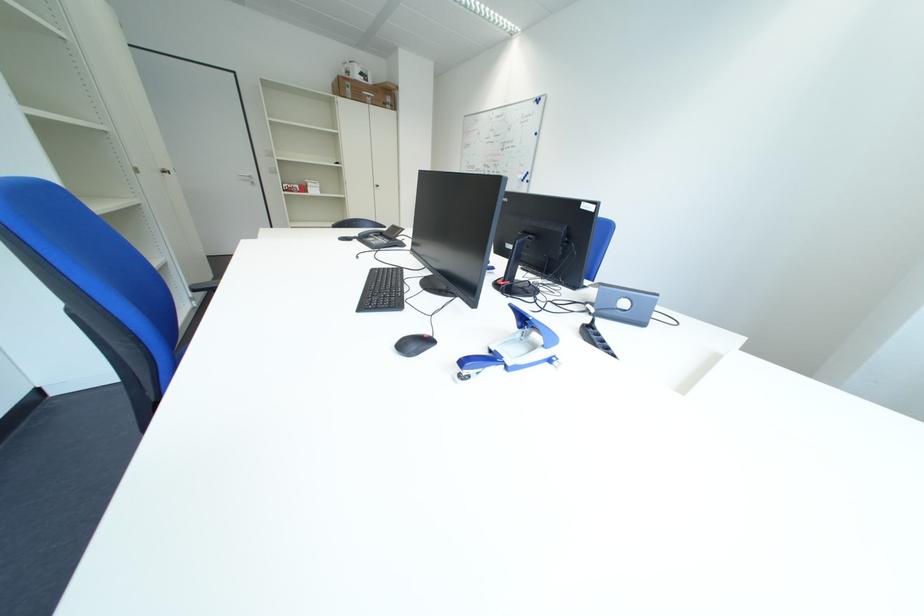
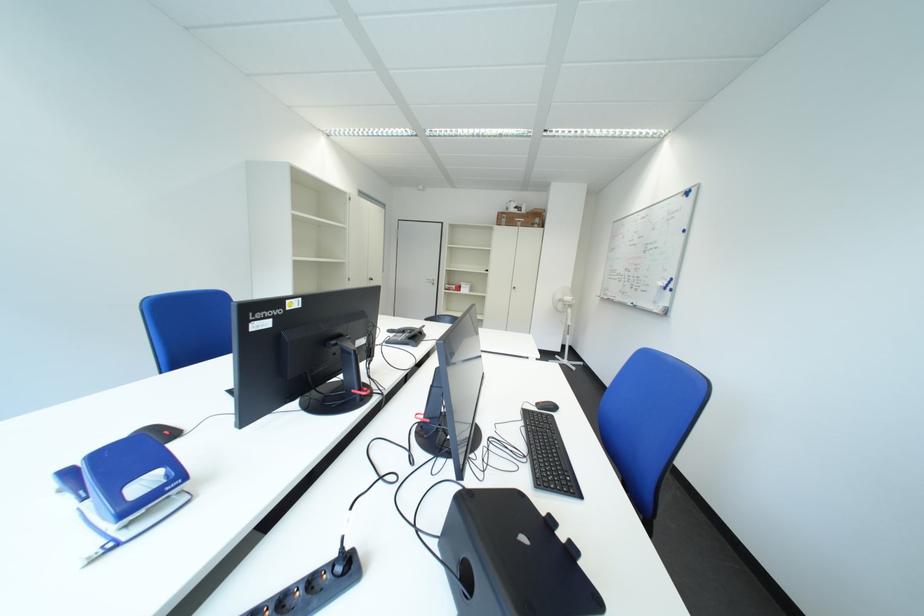
In the second image, find the point that corresponds to (360,92) in the first image.

(517, 223)